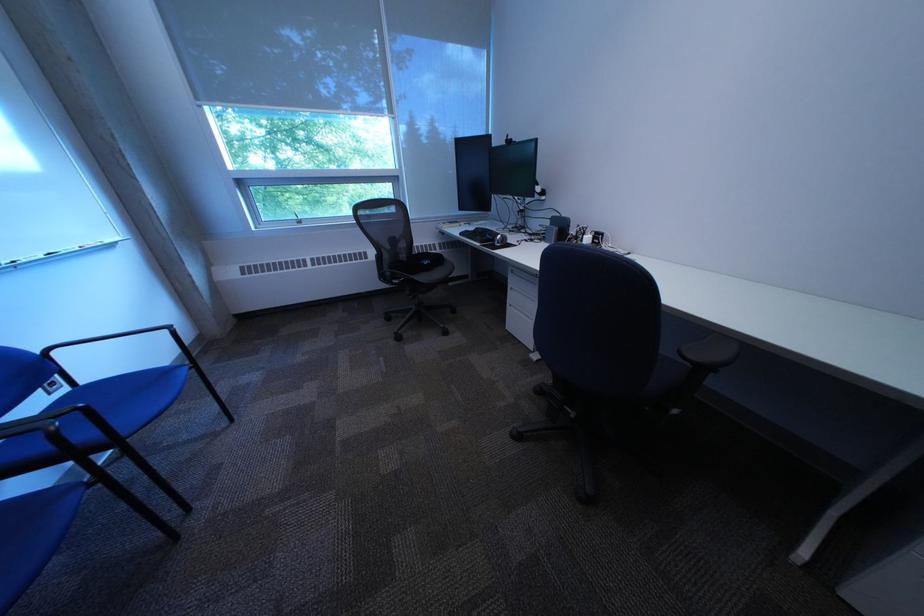
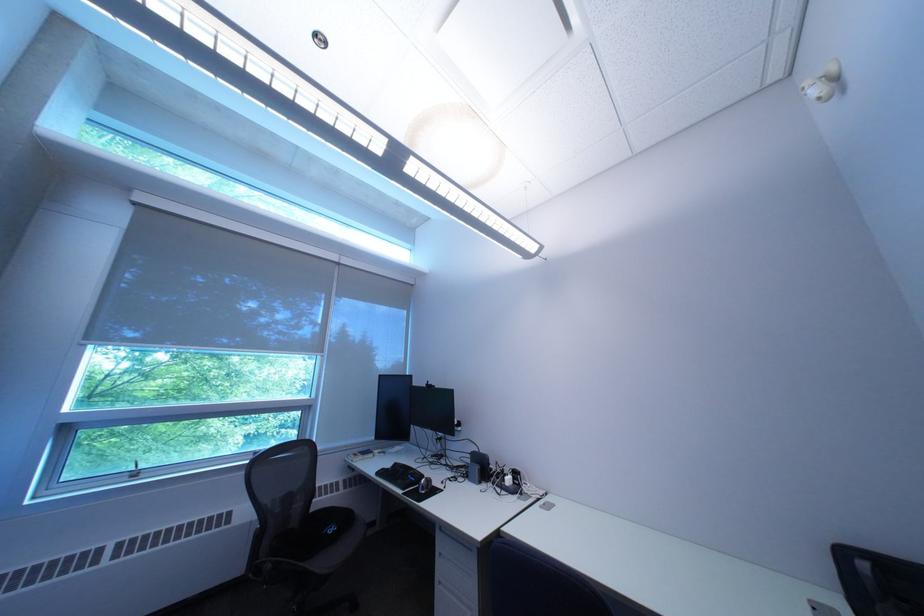
Find the pixel in the second image that matches (x=404, y=275) in the first image.

(285, 568)